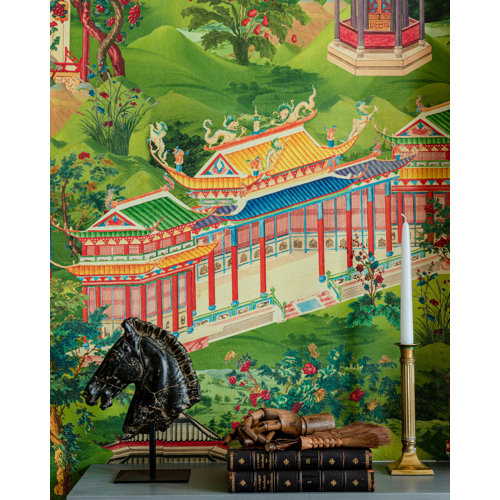
Where is `candle wick`? This screenshot has width=500, height=500. candle wick is located at coordinates (403, 217).